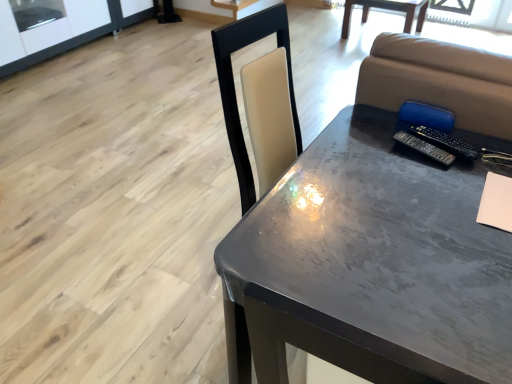
The width and height of the screenshot is (512, 384). I want to click on vacant area that lies in front of black plastic remote at upper right, which ranks as the second remote in left-to-right order, so click(448, 186).